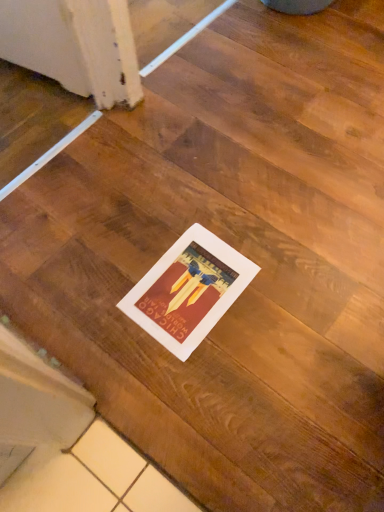
The width and height of the screenshot is (384, 512). What are the coordinates of `free region under matte paper poster at center (from a real-world perspective)` in the screenshot? It's located at (187, 291).